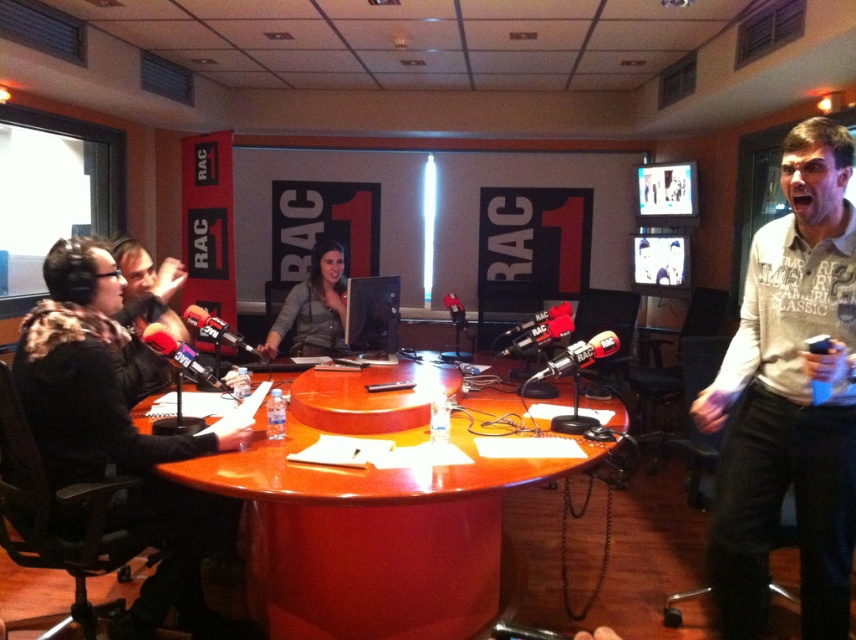
You are a guest entering the studio and need to sit down. You see the white cotton shirt at right and the glossy wood table at center. Which object is closer to you as you enter?

The white cotton shirt at right is closer to the viewer than the glossy wood table at center, so the white cotton shirt at right is closer to you as you enter.

You are a guest entering the studio and need to sit down. You see the white cotton shirt at right and the glossy wood table at center. Which object should you approach to find a seat?

The glossy wood table at center is the object you should approach to find a seat, as it is a table where seating is typically located. The white cotton shirt at right is a person wearing a shirt and cannot be sat upon.

You are a guest speaker in the radio studio and need to choose a microphone that is easier to handle due to its size. Which microphone should you pick between the matte black microphone at left and the metallic black microphone at center?

The matte black microphone at left has a smaller size compared to the metallic black microphone at center, so it would be easier to handle due to its smaller size.